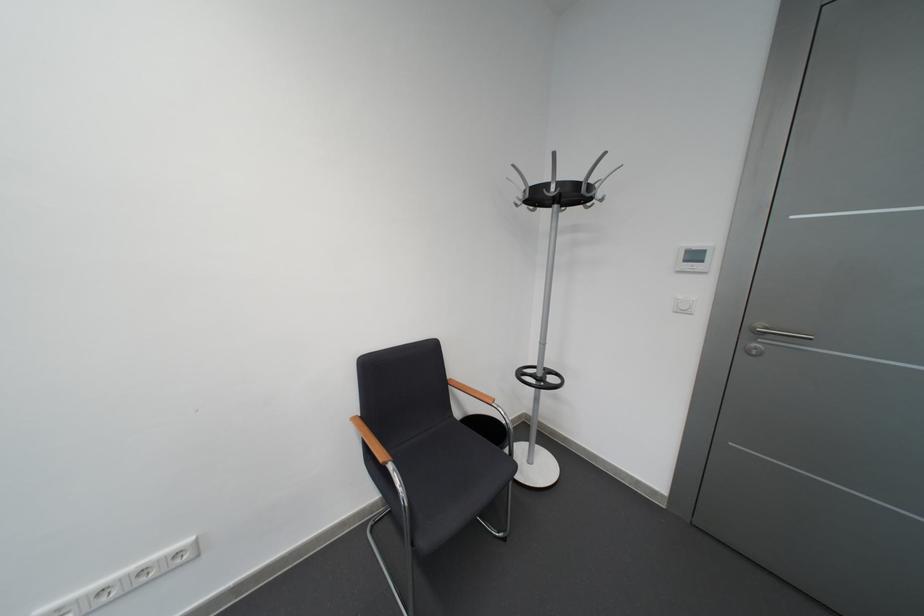
Where would you hang the coat rack hook? Please return your answer as a coordinate pair (x, y).

(561, 188)